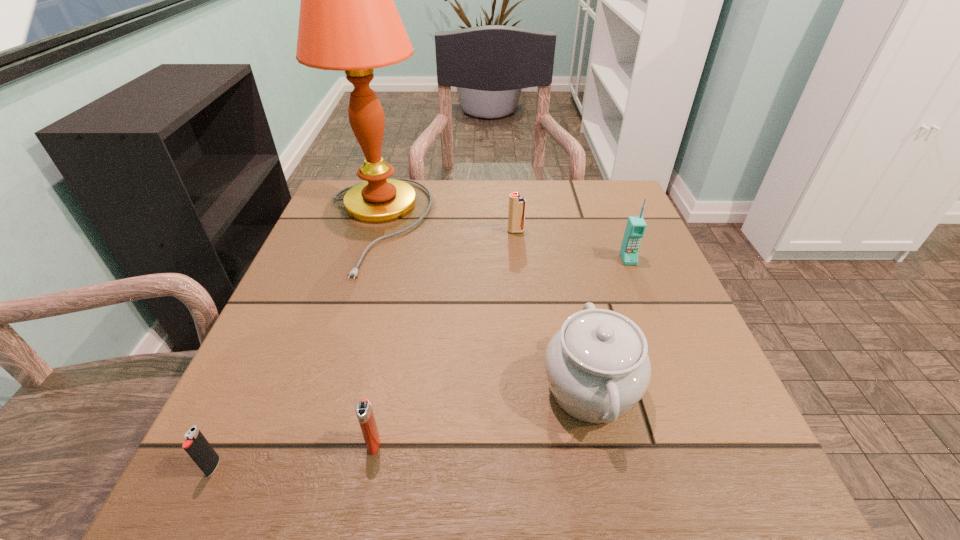
At what (x,y) coordinates should I click in order to perform the action: click on igniter object that ranks as the closest to the chinaware. Please return your answer as a coordinate pair (x, y). The width and height of the screenshot is (960, 540). Looking at the image, I should click on (364, 412).

Identify the location of vacant region that satisfies the following two spatial constraints: 1. on the back side of the chinaware; 2. on the right side of the second nearest igniter. (384, 390).

In order to click on vacant space that satisfies the following two spatial constraints: 1. on the front side of the lamp; 2. on the right side of the farthest igniter in this screenshot , I will do `click(374, 232)`.